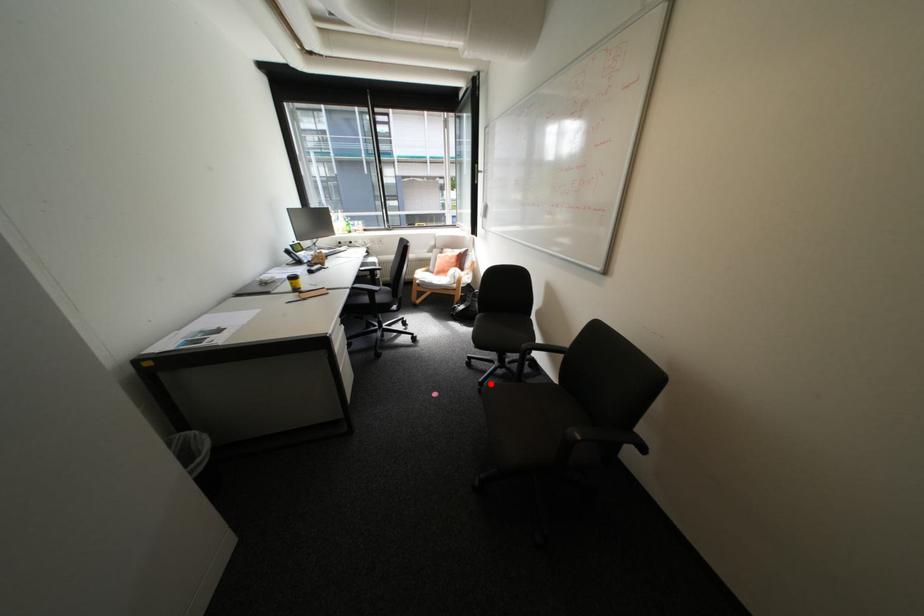
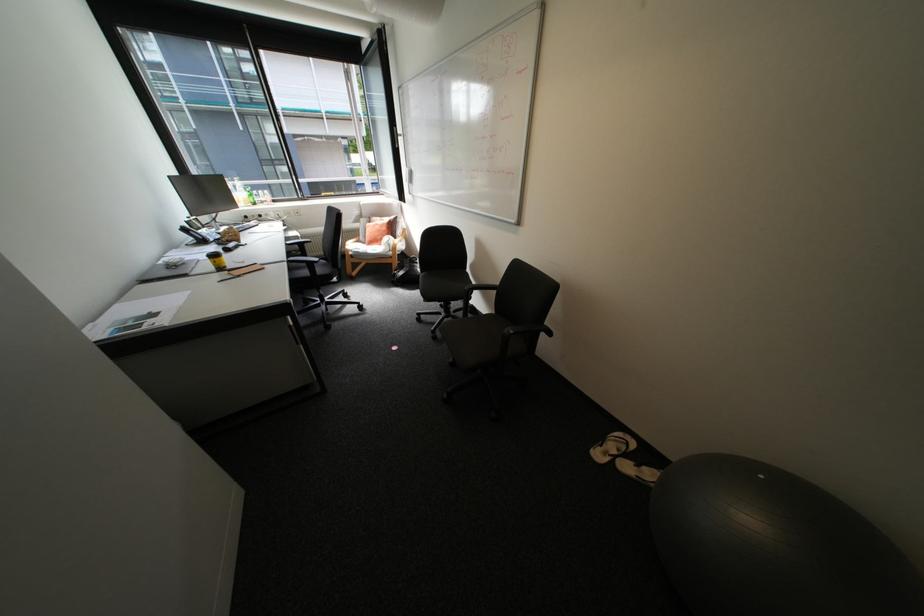
Where in the second image is the point corresponding to the highlighted location from the first image?

(444, 331)